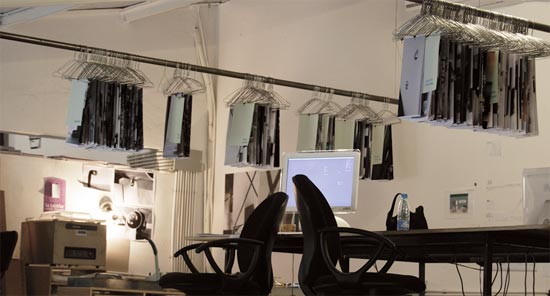
The image size is (550, 296). I want to click on chairs, so click(x=314, y=255), click(x=258, y=228).